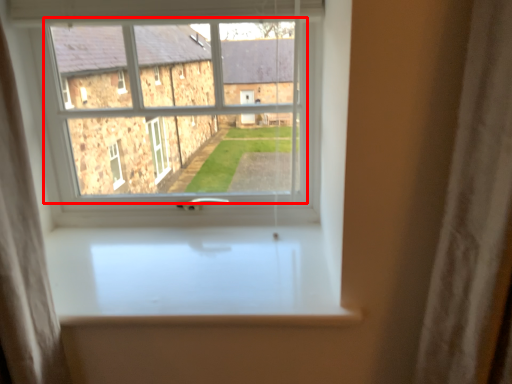
Question: Observing the image, what is the correct spatial positioning of bay window (annotated by the red box) in reference to window sill?

Choices:
 (A) left
 (B) right

Answer: (A)